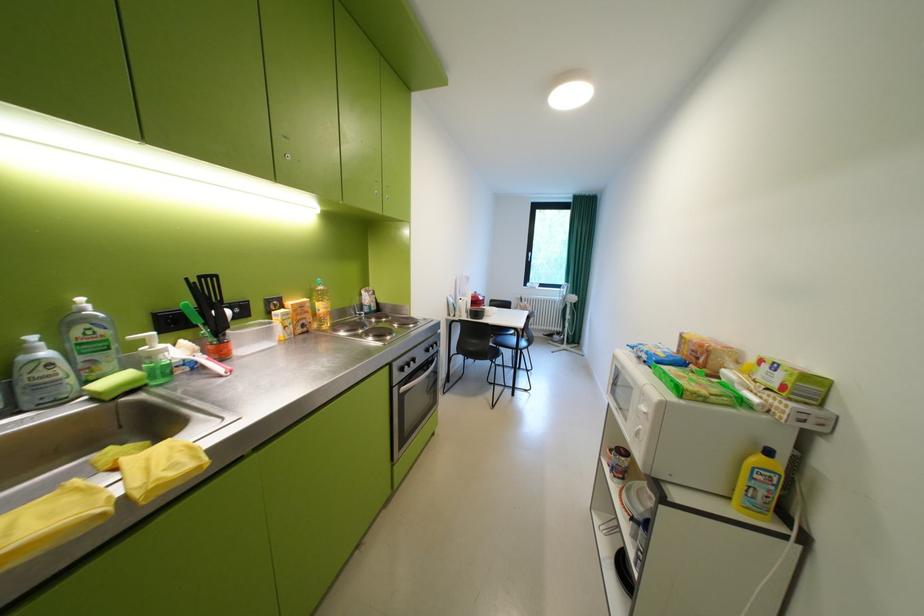
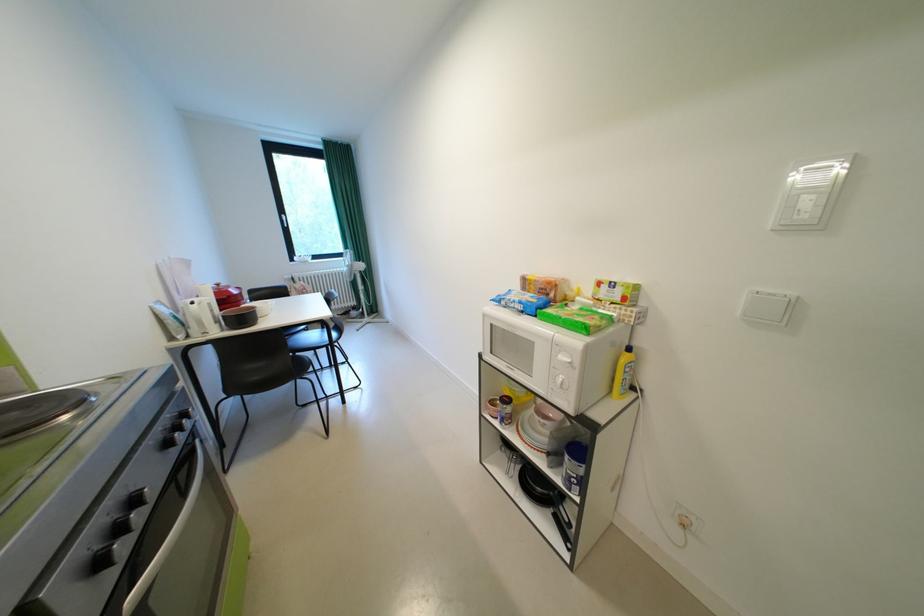
Question: The camera is either moving clockwise (left) or counter-clockwise (right) around the object. The first image is from the beginning of the video and the second image is from the end. Is the camera moving left or right when shooting the video?

Choices:
 (A) Left
 (B) Right

Answer: (A)